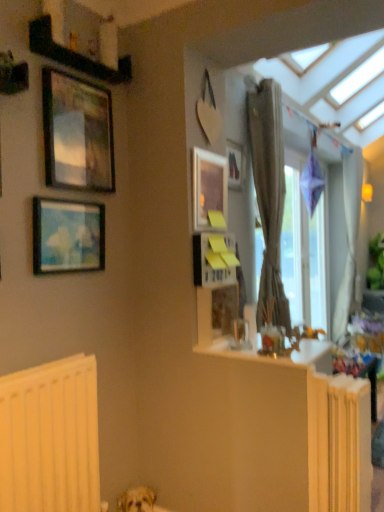
Question: Can you confirm if matte wooden picture frame at upper center, the second picture frame in the back-to-front sequence, is positioned to the left of wooden picture frame at upper center, acting as the 4th picture frame starting from the front?

Choices:
 (A) no
 (B) yes

Answer: (B)

Question: Is wooden picture frame at upper center, which is the first picture frame from right to left, completely or partially inside matte wooden picture frame at upper center, the second picture frame viewed from the right?

Choices:
 (A) no
 (B) yes

Answer: (A)

Question: Is matte wooden picture frame at upper center, the second picture frame viewed from the right, touching wooden picture frame at upper center, acting as the 4th picture frame starting from the front?

Choices:
 (A) no
 (B) yes

Answer: (A)

Question: From a real-world perspective, is matte wooden picture frame at upper center, the second picture frame in the back-to-front sequence, below wooden picture frame at upper center, the 1th picture frame positioned from the back?

Choices:
 (A) no
 (B) yes

Answer: (B)

Question: Can you confirm if matte wooden picture frame at upper center, the second picture frame viewed from the right, is smaller than wooden picture frame at upper center, which is the 4th picture frame in left-to-right order?

Choices:
 (A) yes
 (B) no

Answer: (A)

Question: Is matte wooden picture frame at upper center, the third picture frame viewed from the left, positioned before wooden picture frame at upper center, which is the 4th picture frame in left-to-right order?

Choices:
 (A) yes
 (B) no

Answer: (A)

Question: Considering the relative positions of white sheer curtain at right, the second curtain viewed from the front, and wooden picture frame at upper center, which is the 4th picture frame in left-to-right order, in the image provided, is white sheer curtain at right, the second curtain viewed from the front, in front of wooden picture frame at upper center, which is the 4th picture frame in left-to-right order,?

Choices:
 (A) no
 (B) yes

Answer: (A)

Question: Is white sheer curtain at right, the second curtain viewed from the front, to the right of wooden picture frame at upper center, which is the first picture frame from right to left, from the viewer's perspective?

Choices:
 (A) yes
 (B) no

Answer: (A)

Question: Does white sheer curtain at right, the first curtain viewed from the back, have a larger size compared to wooden picture frame at upper center, which is the 4th picture frame in left-to-right order?

Choices:
 (A) yes
 (B) no

Answer: (A)

Question: Is white sheer curtain at right, which ranks as the first curtain in right-to-left order, wider than wooden picture frame at upper center, which is the 4th picture frame in left-to-right order?

Choices:
 (A) yes
 (B) no

Answer: (A)

Question: Does white sheer curtain at right, which ranks as the first curtain in right-to-left order, lie behind wooden picture frame at upper center, which is the first picture frame from right to left?

Choices:
 (A) no
 (B) yes

Answer: (B)

Question: Considering the relative sizes of white sheer curtain at right, placed as the 2th curtain when sorted from left to right, and wooden picture frame at upper center, the 1th picture frame positioned from the back, in the image provided, is white sheer curtain at right, placed as the 2th curtain when sorted from left to right, taller than wooden picture frame at upper center, the 1th picture frame positioned from the back,?

Choices:
 (A) yes
 (B) no

Answer: (A)

Question: From the image's perspective, is yellow painted radiator at lower right, which is the first radiator from right to left, located beneath metallic gold picture frame at upper left, acting as the third picture frame starting from the back?

Choices:
 (A) no
 (B) yes

Answer: (B)